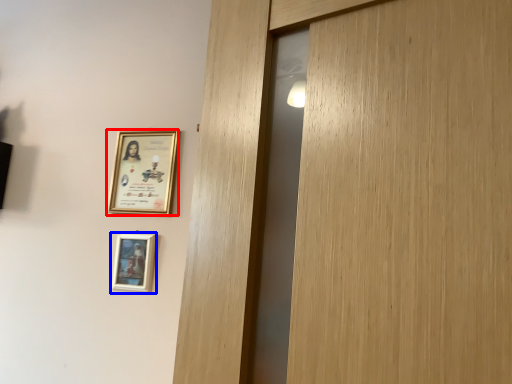
Question: Which point is closer to the camera, picture frame (highlighted by a red box) or picture frame (highlighted by a blue box)?

Choices:
 (A) picture frame
 (B) picture frame

Answer: (B)